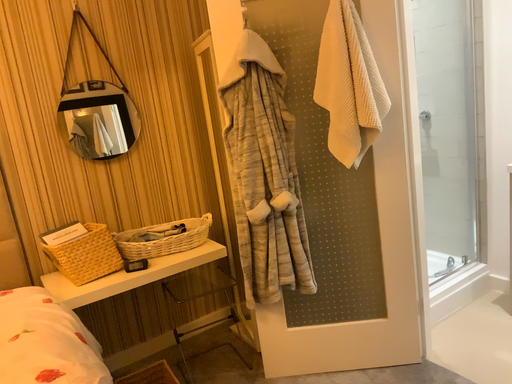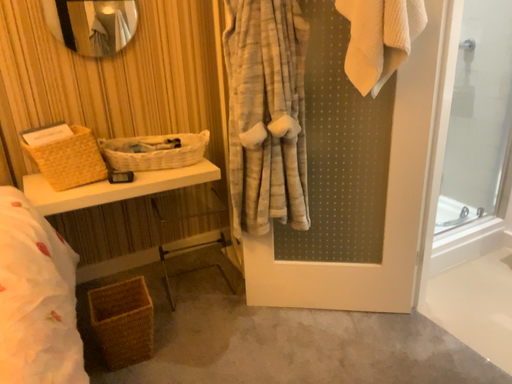
Question: Which way did the camera rotate in the video?

Choices:
 (A) rotated downward
 (B) rotated upward

Answer: (A)